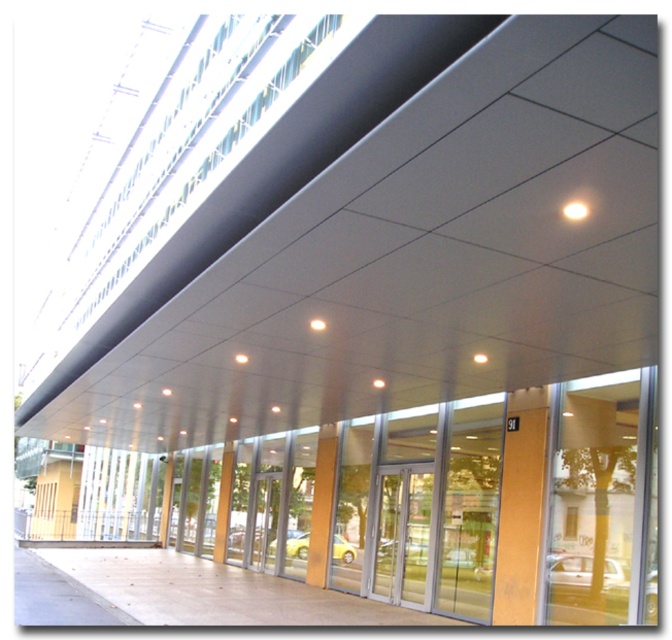
In the scene shown: Does yellow matte pillar at center appear under smooth yellow pillar at center?

No.

Does yellow matte pillar at center have a greater width compared to smooth yellow pillar at center?

Correct, the width of yellow matte pillar at center exceeds that of smooth yellow pillar at center.

Describe the element at coordinates (321, 506) in the screenshot. I see `yellow matte pillar at center` at that location.

Locate an element on the screen. The width and height of the screenshot is (672, 640). yellow matte pillar at center is located at coordinates (321, 506).

In the scene shown: Who is more forward, (394, 492) or (314, 465)?

Point (394, 492)

Between transparent glass door at center and yellow matte pillar at center, which one appears on the left side from the viewer's perspective?

yellow matte pillar at center

What do you see at coordinates (403, 532) in the screenshot?
I see `transparent glass door at center` at bounding box center [403, 532].

In order to click on transparent glass door at center in this screenshot , I will do `click(403, 532)`.

Does transparent glass door at center come behind smooth yellow pillar at center?

That is False.

Describe the element at coordinates (403, 532) in the screenshot. I see `transparent glass door at center` at that location.

You are a GUI agent. You are given a task and a screenshot of the screen. Output one action in this format:
    pyautogui.click(x=<x>, y=<y>)
    Task: Click on the transparent glass door at center
    The height and width of the screenshot is (640, 672).
    Given the screenshot: What is the action you would take?
    pyautogui.click(x=403, y=532)